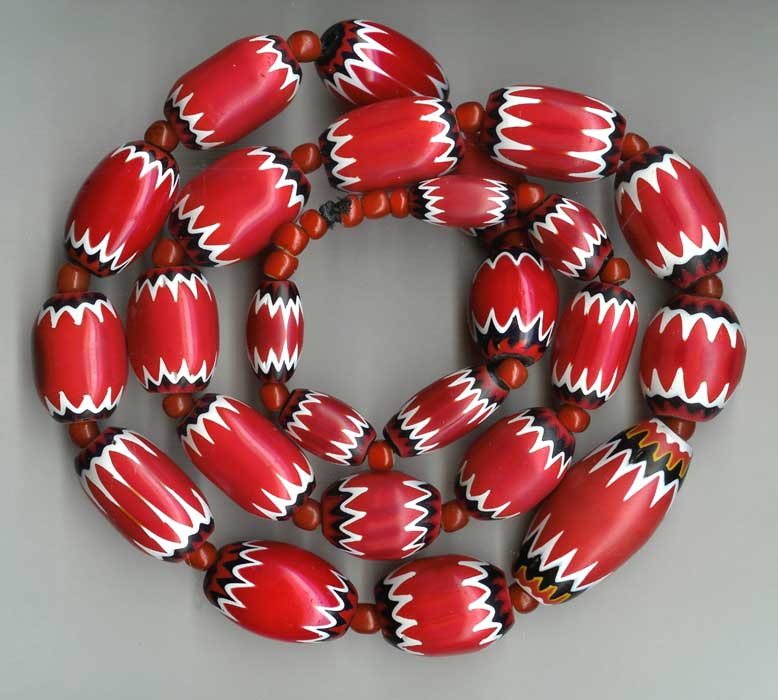
Identify the location of grey table. coord(384,339).